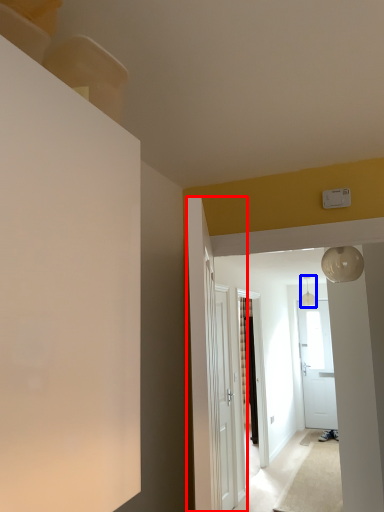
Question: Which of the following is the closest to the observer, door (highlighted by a red box) or light fixture (highlighted by a blue box)?

Choices:
 (A) door
 (B) light fixture

Answer: (A)